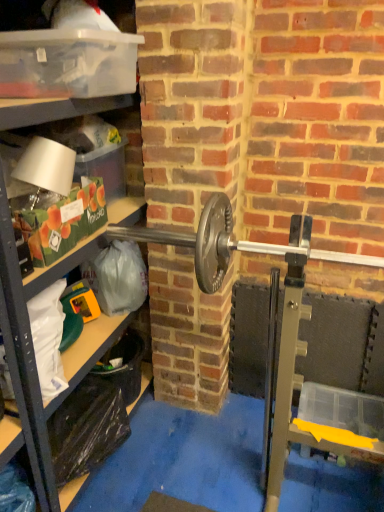
Question: From a real-world perspective, is clear plastic shelf at left on top of transparent plastic container at upper left?

Choices:
 (A) yes
 (B) no

Answer: (B)

Question: Is clear plastic shelf at left outside transparent plastic container at upper left?

Choices:
 (A) yes
 (B) no

Answer: (A)

Question: Considering the relative positions of clear plastic shelf at left and transparent plastic container at upper left in the image provided, is clear plastic shelf at left to the right of transparent plastic container at upper left from the viewer's perspective?

Choices:
 (A) yes
 (B) no

Answer: (B)

Question: Is transparent plastic container at upper left a part of clear plastic shelf at left?

Choices:
 (A) yes
 (B) no

Answer: (A)

Question: Is clear plastic shelf at left bigger than transparent plastic container at upper left?

Choices:
 (A) no
 (B) yes

Answer: (B)

Question: Is clear plastic shelf at left taller than transparent plastic container at upper left?

Choices:
 (A) yes
 (B) no

Answer: (A)

Question: Is transparent plastic container at upper left at the left side of clear plastic shelf at left?

Choices:
 (A) no
 (B) yes

Answer: (A)

Question: From a real-world perspective, is transparent plastic container at upper left on top of clear plastic shelf at left?

Choices:
 (A) yes
 (B) no

Answer: (A)

Question: Is transparent plastic container at upper left aimed at clear plastic shelf at left?

Choices:
 (A) no
 (B) yes

Answer: (B)

Question: From a real-world perspective, does transparent plastic container at upper left sit lower than clear plastic shelf at left?

Choices:
 (A) no
 (B) yes

Answer: (A)

Question: Is transparent plastic container at upper left positioned with its back to clear plastic shelf at left?

Choices:
 (A) yes
 (B) no

Answer: (A)

Question: Does transparent plastic container at upper left have a larger size compared to clear plastic shelf at left?

Choices:
 (A) yes
 (B) no

Answer: (B)

Question: From the image's perspective, relative to transparent plastic container at upper left, is clear plastic shelf at left above or below?

Choices:
 (A) below
 (B) above

Answer: (A)